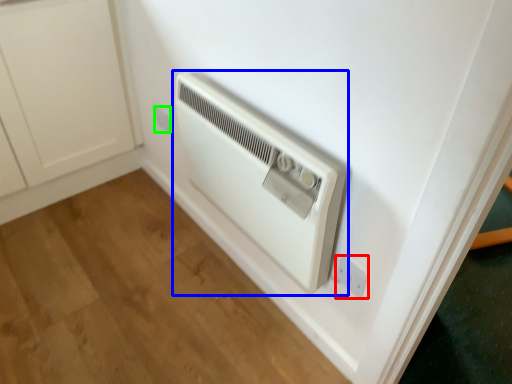
Question: Which object is positioned farthest from electric outlet (highlighted by a red box)? Select from home appliance (highlighted by a blue box) and electric outlet (highlighted by a green box).

Choices:
 (A) home appliance
 (B) electric outlet

Answer: (B)